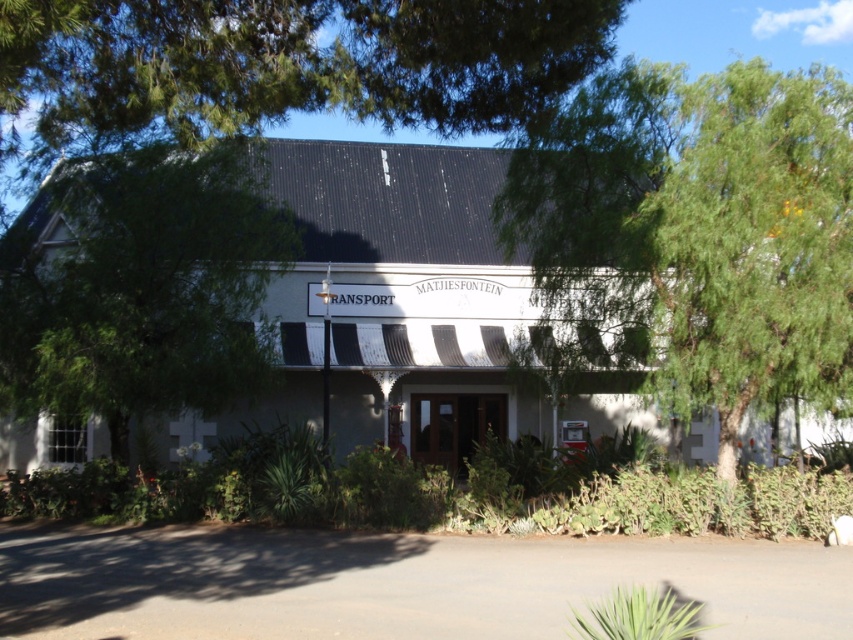
You are standing in front of the MATJIESFONTEIN TRANSPORT MUSEUM. There are two points marked on the building facade. The first point is at coordinate [397,102] and the second at [0,384]. If you were to walk towards the building, which point would you encounter first?

Point [397,102] is closer to the viewer than point [0,384], so you would encounter point [397,102] first as you approach the building.